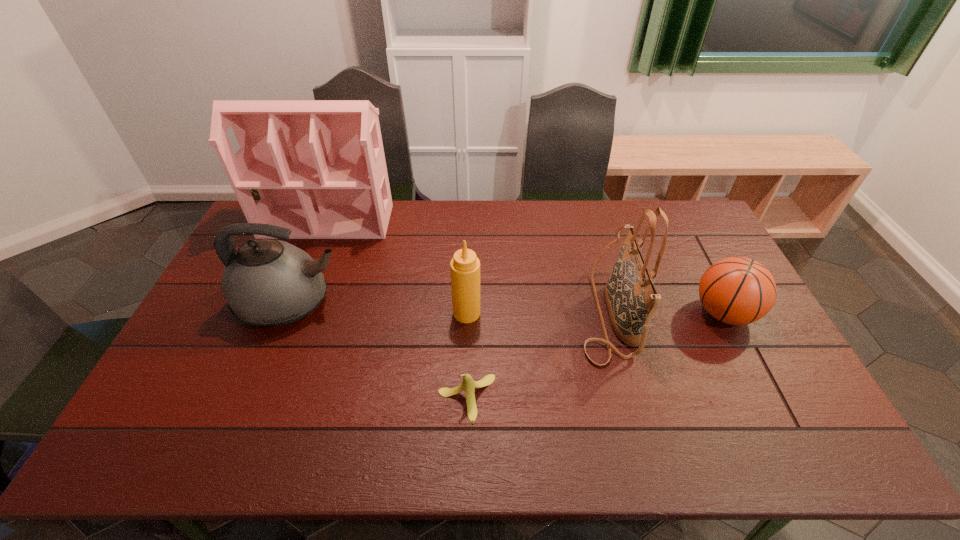
The width and height of the screenshot is (960, 540). Identify the location of dollhouse that is at the left edge. (319, 167).

Where is `kettle that is at the left edge`? kettle that is at the left edge is located at coordinates (x=266, y=282).

The height and width of the screenshot is (540, 960). I want to click on object that is positioned at the right edge, so click(736, 290).

Image resolution: width=960 pixels, height=540 pixels. Identify the location of object positioned at the far left corner. (319, 167).

Locate an element on the screen. Image resolution: width=960 pixels, height=540 pixels. vacant space at the far edge of the desktop is located at coordinates (626, 206).

In the image, there is a desktop. In order to click on vacant region at the near edge in this screenshot , I will do `click(235, 441)`.

This screenshot has height=540, width=960. What are the coordinates of `free spot at the left edge of the desktop` in the screenshot? It's located at (215, 319).

Identify the location of free space at the right edge of the desktop. Image resolution: width=960 pixels, height=540 pixels. pyautogui.click(x=682, y=267).

The width and height of the screenshot is (960, 540). What are the coordinates of `vacant space at the far right corner of the desktop` in the screenshot? It's located at (689, 222).

You are a GUI agent. You are given a task and a screenshot of the screen. Output one action in this format:
    pyautogui.click(x=<x>, y=<y>)
    Task: Click on the free space between the kettle and the condiment
    The width and height of the screenshot is (960, 540).
    Given the screenshot: What is the action you would take?
    pyautogui.click(x=379, y=308)